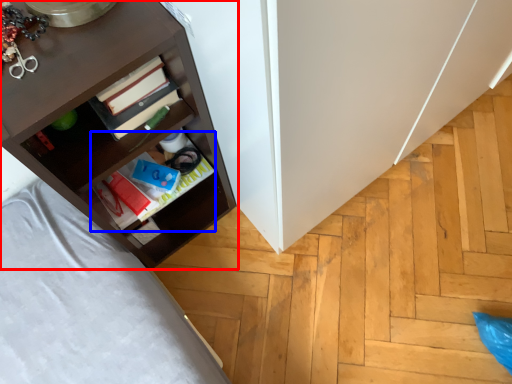
Question: Which point is further to the camera, shelf (highlighted by a red box) or book (highlighted by a blue box)?

Choices:
 (A) shelf
 (B) book

Answer: (B)